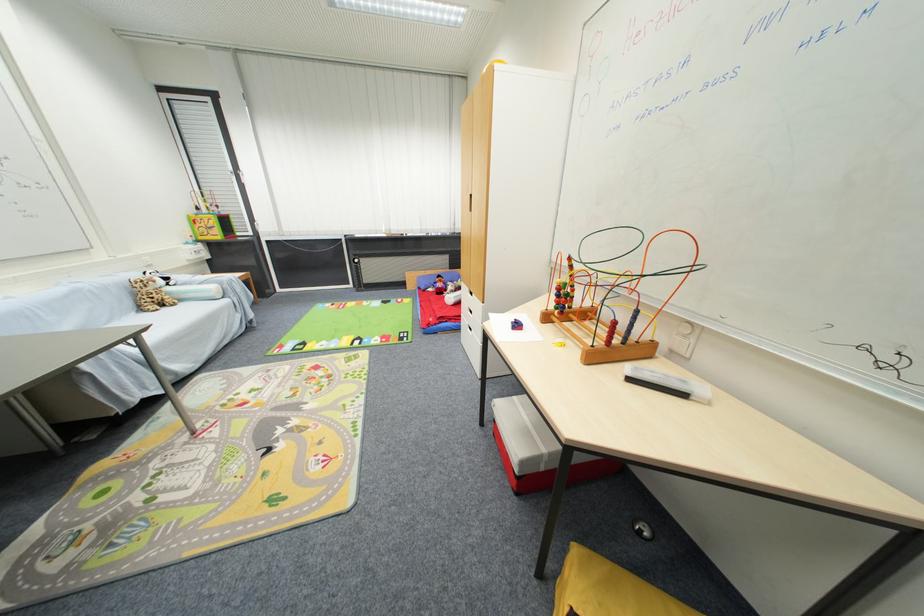
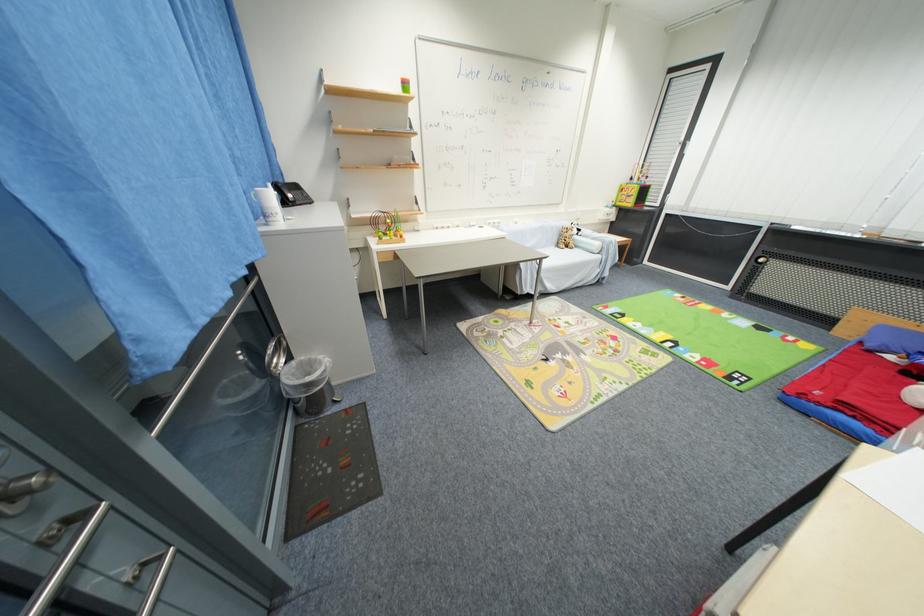
In the second image, find the point that corresponds to [171,310] in the first image.

(572, 251)